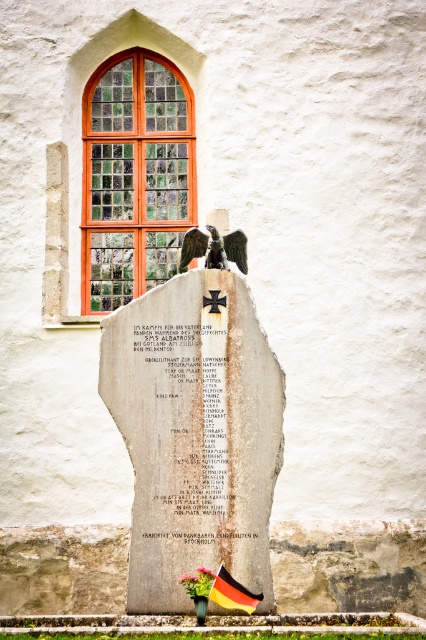
Question: Which of the following is the farthest from the observer?

Choices:
 (A) pink matte flower at center
 (B) white paper at center
 (C) gray stone monument at center
 (D) polished bronze eagle at center

Answer: (D)

Question: Which is farther from the multicolored glass mosaic at upper left?

Choices:
 (A) pink fabric flower at center
 (B) gray stone monument at center
 (C) white paper at center

Answer: (A)

Question: Estimate the real-world distances between objects in this image. Which object is farther from the gray stone monument at center?

Choices:
 (A) pink fabric flower at center
 (B) pink matte flower at center
 (C) white paper at center

Answer: (B)

Question: Where is white paper at center located in relation to pink fabric flower at center in the image?

Choices:
 (A) above
 (B) below

Answer: (A)

Question: From the image, what is the correct spatial relationship of gray stone monument at center in relation to pink matte flower at center?

Choices:
 (A) above
 (B) below

Answer: (A)

Question: Where is gray stone monument at center located in relation to pink fabric flower at center in the image?

Choices:
 (A) left
 (B) right

Answer: (A)